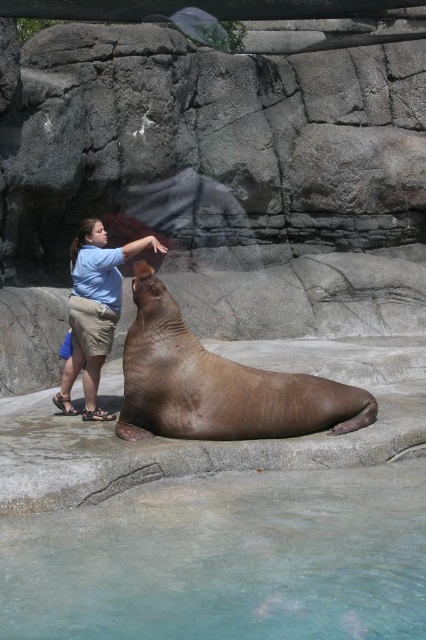
Can you confirm if clear glass water at lower center is positioned above brown smooth seal at center?

Actually, clear glass water at lower center is below brown smooth seal at center.

Can you confirm if clear glass water at lower center is shorter than brown smooth seal at center?

Indeed, clear glass water at lower center has a lesser height compared to brown smooth seal at center.

The width and height of the screenshot is (426, 640). What are the coordinates of `clear glass water at lower center` in the screenshot? It's located at (226, 560).

This screenshot has height=640, width=426. Describe the element at coordinates (218, 385) in the screenshot. I see `brown smooth seal at center` at that location.

Can you confirm if brown smooth seal at center is bigger than light blue shirt at center?

Actually, brown smooth seal at center might be smaller than light blue shirt at center.

Describe the element at coordinates (218, 385) in the screenshot. I see `brown smooth seal at center` at that location.

Find the location of a particular element. Image resolution: width=426 pixels, height=640 pixels. brown smooth seal at center is located at coordinates (218, 385).

Who is positioned more to the right, clear glass water at lower center or light blue shirt at center?

From the viewer's perspective, clear glass water at lower center appears more on the right side.

Based on the photo, does clear glass water at lower center have a larger size compared to light blue shirt at center?

Yes, clear glass water at lower center is bigger than light blue shirt at center.

Is point (172, 536) positioned behind point (115, 300)?

That is False.

Where is `clear glass water at lower center`? This screenshot has width=426, height=640. clear glass water at lower center is located at coordinates (226, 560).